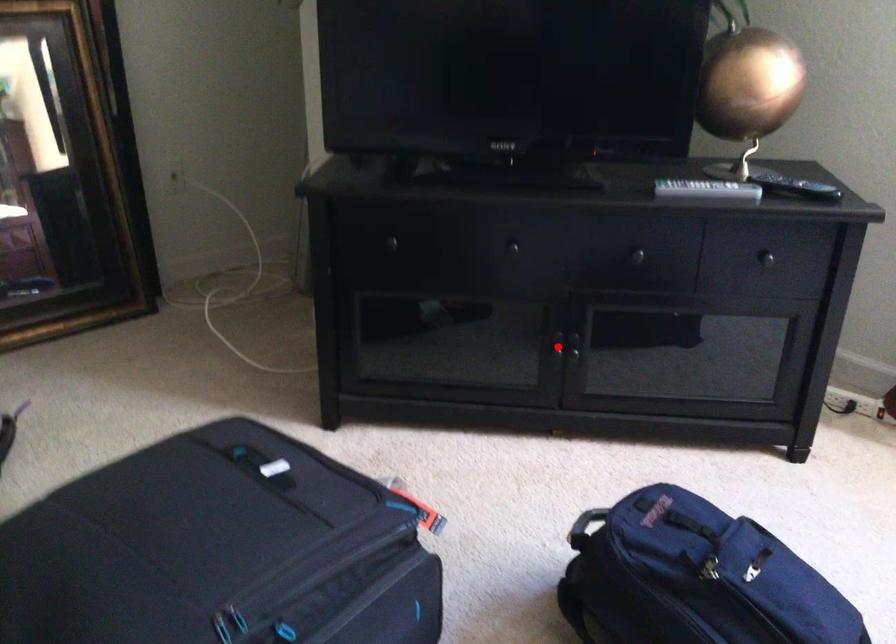
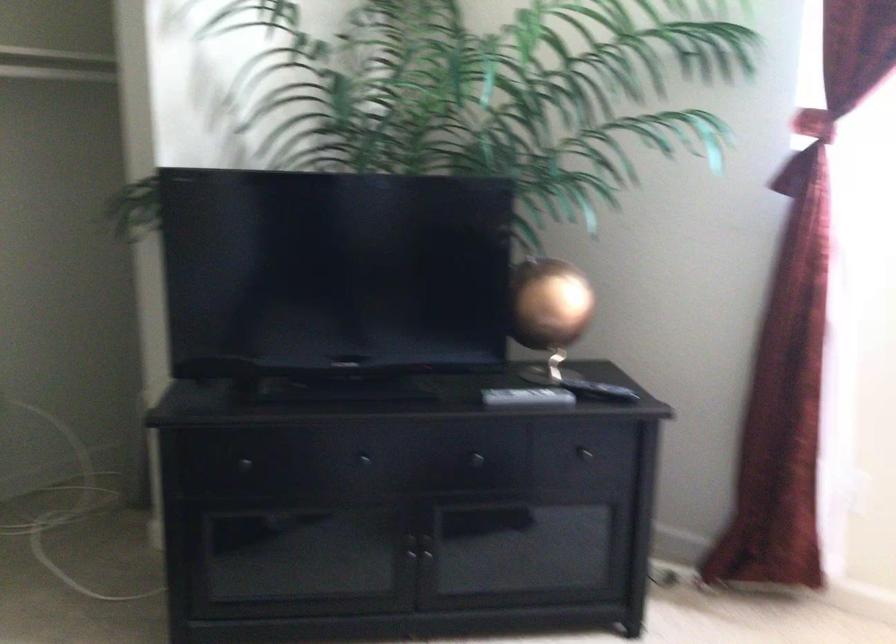
The point at the highlighted location is marked in the first image. Where is the corresponding point in the second image?

(410, 547)